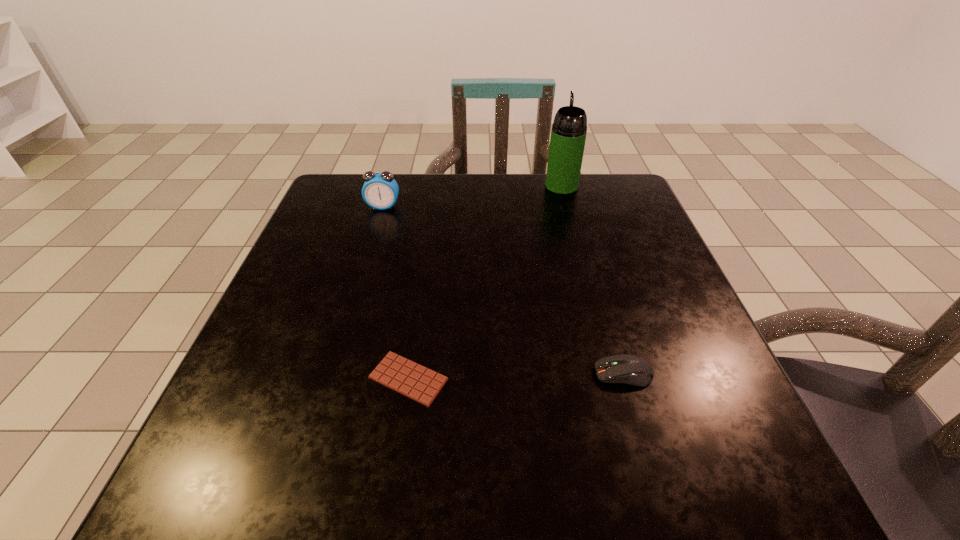
Where is `free location located 0.210m on the button of the third tallest object`? The image size is (960, 540). free location located 0.210m on the button of the third tallest object is located at coordinates (465, 374).

Where is `vacant area situated 0.070m on the back of the third object from right to left`? The width and height of the screenshot is (960, 540). vacant area situated 0.070m on the back of the third object from right to left is located at coordinates (417, 322).

The height and width of the screenshot is (540, 960). I want to click on thermos bottle at the far edge, so click(x=568, y=135).

This screenshot has height=540, width=960. I want to click on alarm clock that is at the far edge, so click(380, 190).

Image resolution: width=960 pixels, height=540 pixels. I want to click on object positioned at the left edge, so click(x=380, y=190).

Where is `thermos bottle that is positioned at the right edge`? The width and height of the screenshot is (960, 540). thermos bottle that is positioned at the right edge is located at coordinates (568, 135).

The width and height of the screenshot is (960, 540). Find the location of `computer equipment present at the right edge`. computer equipment present at the right edge is located at coordinates (627, 369).

Identify the location of object that is at the far left corner. Image resolution: width=960 pixels, height=540 pixels. (380, 190).

The height and width of the screenshot is (540, 960). I want to click on object that is at the far right corner, so click(x=568, y=135).

The height and width of the screenshot is (540, 960). In order to click on vacant space at the far edge of the desktop in this screenshot , I will do `click(486, 185)`.